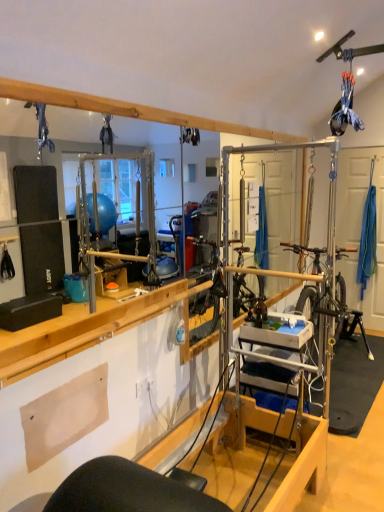
In order to click on blue fabric at right in this screenshot , I will do `click(360, 228)`.

Describe the element at coordinates (360, 228) in the screenshot. I see `blue fabric at right` at that location.

Locate an element on the screen. The height and width of the screenshot is (512, 384). blue fabric at right is located at coordinates (360, 228).